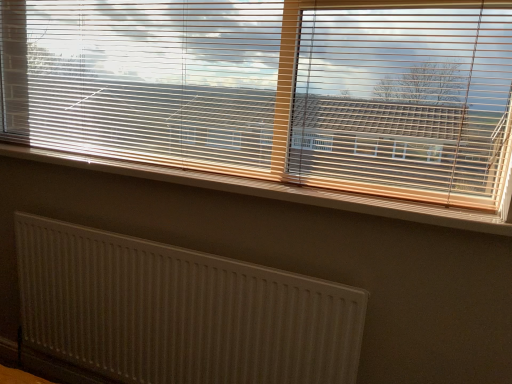
This screenshot has height=384, width=512. Find the location of `wooden blinds at upper center`. wooden blinds at upper center is located at coordinates (270, 87).

What is the approximate height of white textured radiator at lower left?

white textured radiator at lower left is 26.86 inches tall.

At what (x,y) coordinates should I click in order to perform the action: click on white plastic radiator at lower center. Please return your answer as a coordinate pair (x, y). The width and height of the screenshot is (512, 384). Looking at the image, I should click on (276, 191).

Is wooden blinds at upper center spatially inside white plastic radiator at lower center, or outside of it?

wooden blinds at upper center is spatially situated outside white plastic radiator at lower center.

Is wooden blinds at upper center facing towards white plastic radiator at lower center?

Yes, wooden blinds at upper center is facing white plastic radiator at lower center.

From the image's perspective, which is below, wooden blinds at upper center or white plastic radiator at lower center?

white plastic radiator at lower center.

Is white textured radiator at lower left at the back of wooden blinds at upper center?

That's not correct — wooden blinds at upper center is not looking away from white textured radiator at lower left.

Considering the relative sizes of wooden blinds at upper center and white textured radiator at lower left in the image provided, is wooden blinds at upper center smaller than white textured radiator at lower left?

Incorrect, wooden blinds at upper center is not smaller in size than white textured radiator at lower left.

At what (x,y) coordinates should I click in order to perform the action: click on radiator lying behind the wooden blinds at upper center. Please return your answer as a coordinate pair (x, y). The image size is (512, 384). Looking at the image, I should click on (180, 311).

Are wooden blinds at upper center and white textured radiator at lower left far apart?

wooden blinds at upper center is actually quite close to white textured radiator at lower left.

Is white plastic radiator at lower center thinner than white textured radiator at lower left?

Incorrect, the width of white plastic radiator at lower center is not less than that of white textured radiator at lower left.

From the picture: From a real-world perspective, is white plastic radiator at lower center physically above white textured radiator at lower left?

Yes.

Considering the relative sizes of white plastic radiator at lower center and white textured radiator at lower left in the image provided, is white plastic radiator at lower center shorter than white textured radiator at lower left?

Indeed, white plastic radiator at lower center has a lesser height compared to white textured radiator at lower left.

What's the angular difference between white plastic radiator at lower center and white textured radiator at lower left's facing directions?

There is a 0.0772-degree angle between the facing directions of white plastic radiator at lower center and white textured radiator at lower left.

From the image's perspective, which is above, white textured radiator at lower left or white plastic radiator at lower center?

white plastic radiator at lower center.

Does white textured radiator at lower left have a greater width compared to white plastic radiator at lower center?

No.

Is white textured radiator at lower left taller or shorter than white plastic radiator at lower center?

Considering their sizes, white textured radiator at lower left has more height than white plastic radiator at lower center.

Considering the relative positions of white textured radiator at lower left and white plastic radiator at lower center in the image provided, is white textured radiator at lower left to the left of white plastic radiator at lower center from the viewer's perspective?

Correct, you'll find white textured radiator at lower left to the left of white plastic radiator at lower center.

Considering the relative sizes of white textured radiator at lower left and wooden blinds at upper center in the image provided, is white textured radiator at lower left smaller than wooden blinds at upper center?

Yes.

What's the angular difference between white textured radiator at lower left and wooden blinds at upper center's facing directions?

The angular difference between white textured radiator at lower left and wooden blinds at upper center is 0.131 degrees.

Is white textured radiator at lower left positioned far away from wooden blinds at upper center?

They are positioned close to each other.

Is wooden blinds at upper center inside white textured radiator at lower left?

No, wooden blinds at upper center is not inside white textured radiator at lower left.

Is white plastic radiator at lower center positioned beyond the bounds of wooden blinds at upper center?

white plastic radiator at lower center lies outside wooden blinds at upper center's area.

From a real-world perspective, is white plastic radiator at lower center under wooden blinds at upper center?

Correct, in the physical world, white plastic radiator at lower center is lower than wooden blinds at upper center.

Is point (90, 168) positioned after point (190, 80)?

Yes, point (90, 168) is behind point (190, 80).

Between white plastic radiator at lower center and wooden blinds at upper center, which one has smaller width?

white plastic radiator at lower center is thinner.

You are a GUI agent. You are given a task and a screenshot of the screen. Output one action in this format:
    pyautogui.click(x=<x>, y=<y>)
    Task: Click on the window sill located underneath the wooden blinds at upper center (from a real-world perspective)
    
    Given the screenshot: What is the action you would take?
    pyautogui.click(x=276, y=191)

Where is `window blind above the white textured radiator at lower left (from the image's perspective)`? Image resolution: width=512 pixels, height=384 pixels. window blind above the white textured radiator at lower left (from the image's perspective) is located at coordinates (270, 87).

Based on their spatial positions, is white textured radiator at lower left or white plastic radiator at lower center closer to wooden blinds at upper center?

Based on the image, white plastic radiator at lower center appears to be nearer to wooden blinds at upper center.

Estimate the real-world distances between objects in this image. Which object is further from white textured radiator at lower left, white plastic radiator at lower center or wooden blinds at upper center?

wooden blinds at upper center lies further to white textured radiator at lower left than the other object.

Considering their positions, is white plastic radiator at lower center positioned further to wooden blinds at upper center than white textured radiator at lower left?

white textured radiator at lower left is positioned further to the anchor wooden blinds at upper center.

Looking at the image, which one is located closer to white plastic radiator at lower center, white textured radiator at lower left or wooden blinds at upper center?

The object closer to white plastic radiator at lower center is wooden blinds at upper center.

From the picture: When comparing their distances from white textured radiator at lower left, does wooden blinds at upper center or white plastic radiator at lower center seem further?

Based on the image, wooden blinds at upper center appears to be further to white textured radiator at lower left.

Estimate the real-world distances between objects in this image. Which object is closer to white plastic radiator at lower center, wooden blinds at upper center or white textured radiator at lower left?

Based on the image, wooden blinds at upper center appears to be nearer to white plastic radiator at lower center.

This screenshot has height=384, width=512. What are the coordinates of `window sill between wooden blinds at upper center and white textured radiator at lower left from top to bottom` in the screenshot? It's located at [x=276, y=191].